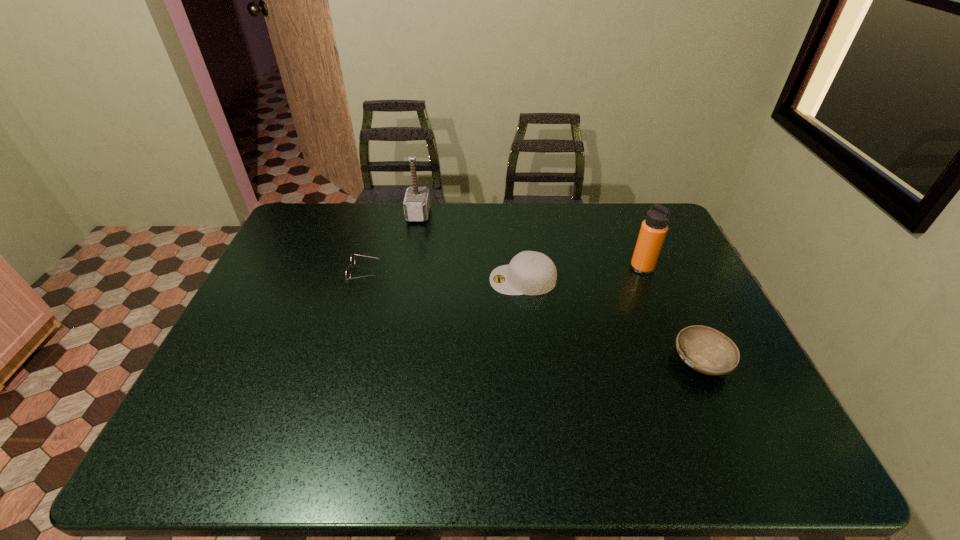
In order to click on vacant space that satisfies the following two spatial constraints: 1. on the front-facing side of the nearest object; 2. on the right side of the cap in this screenshot , I will do `click(532, 361)`.